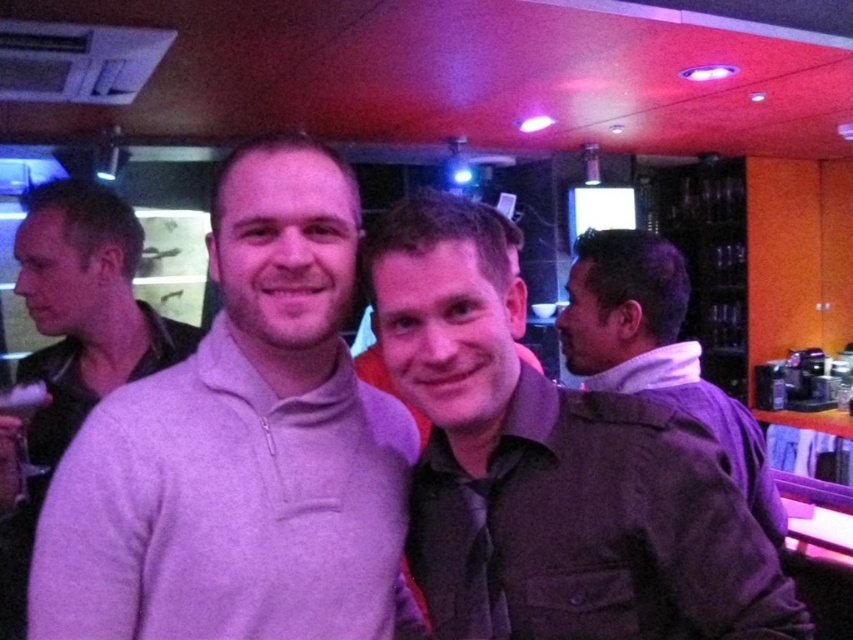
Which of these two, gray fleece sweater at center or matte gray shirt at center, stands shorter?

matte gray shirt at center is shorter.

Does gray fleece sweater at center appear over matte gray shirt at center?

Yes, gray fleece sweater at center is above matte gray shirt at center.

Between point (41, 634) and point (688, 589), which one is positioned in front?

Point (688, 589) is more forward.

At what (x,y) coordinates should I click in order to perform the action: click on gray fleece sweater at center. Please return your answer as a coordinate pair (x, y). The image size is (853, 640). Looking at the image, I should click on (242, 448).

Between matte gray shirt at center and dark brown jacket at right, which one is positioned lower?

dark brown jacket at right is lower down.

Between point (498, 278) and point (611, 230), which one is positioned in front?

Positioned in front is point (498, 278).

Which is behind, point (772, 596) or point (672, 342)?

The point (672, 342) is more distant.

At what (x,y) coordinates should I click in order to perform the action: click on matte gray shirt at center. Please return your answer as a coordinate pair (x, y). This screenshot has width=853, height=640. Looking at the image, I should click on (550, 468).

The width and height of the screenshot is (853, 640). I want to click on gray fleece sweater at center, so click(x=242, y=448).

Between gray fleece sweater at center and light purple sweater at center, which one has more height?

light purple sweater at center

Which is behind, point (378, 484) or point (102, 230)?

Point (102, 230)

Where is `gray fleece sweater at center`? This screenshot has width=853, height=640. gray fleece sweater at center is located at coordinates (242, 448).